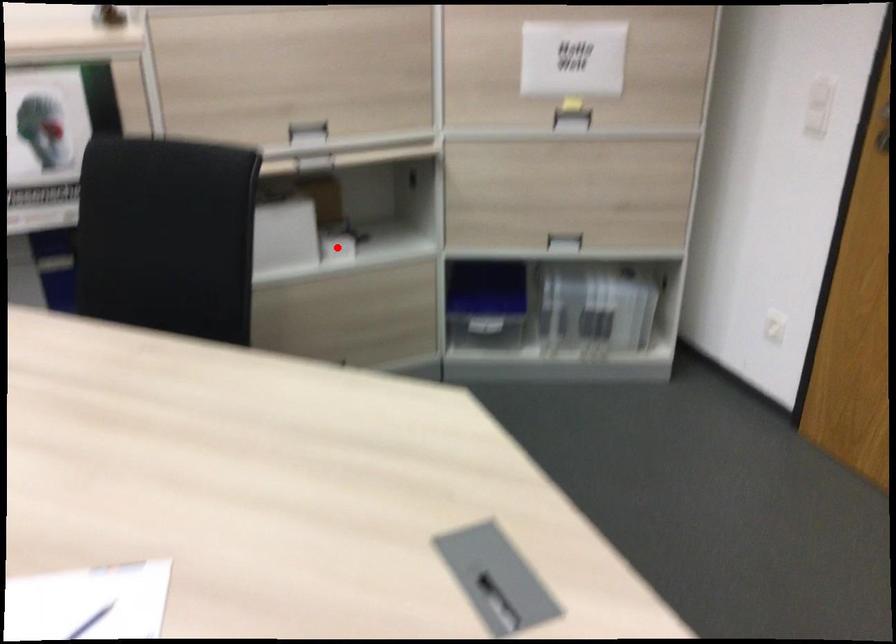
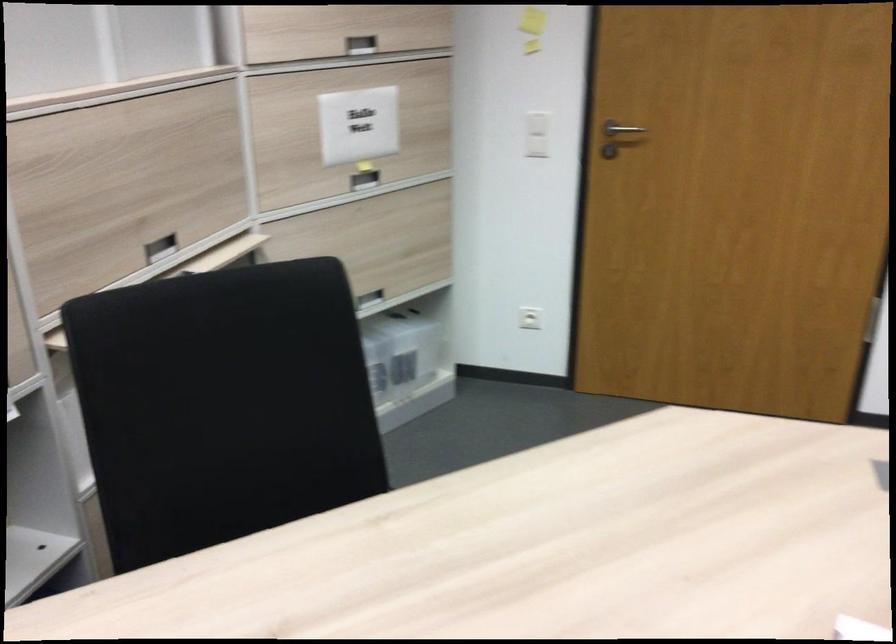
Question: I am providing you with two images of the same scene from different viewpoints. A red point is marked on the first image. Can you still see the location of the red point in image 2?

Choices:
 (A) Yes
 (B) No

Answer: (B)